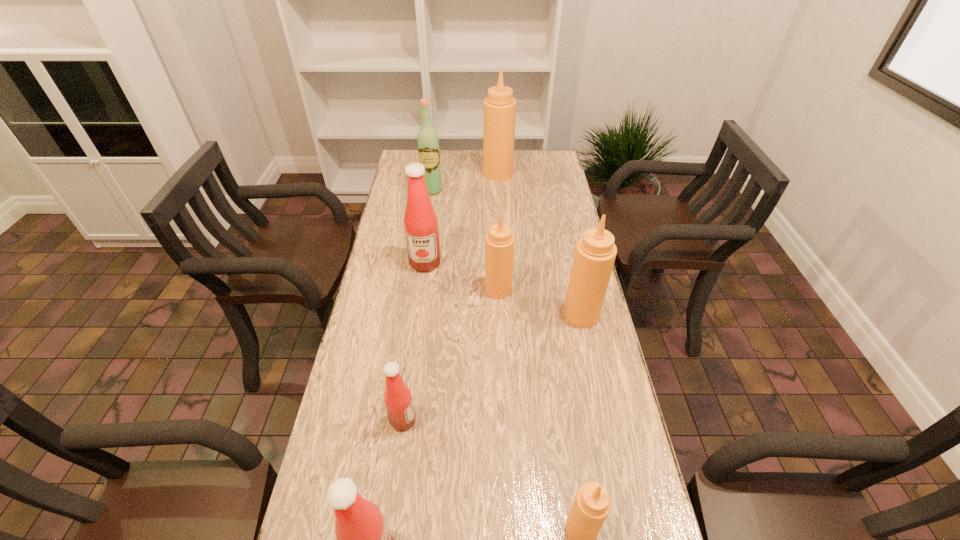
I want to click on the sixth farthest object, so click(x=398, y=400).

Locate an element on the screen. This screenshot has height=540, width=960. the fifth farthest condiment is located at coordinates (398, 400).

At what (x,y) coordinates should I click in order to perform the action: click on free region located 0.140m on the right of the biggest tan condiment. Please return your answer as a coordinate pair (x, y). Looking at the image, I should click on (544, 173).

This screenshot has height=540, width=960. I want to click on vacant space situated on the front-facing side of the white wine bottle, so click(x=425, y=239).

The image size is (960, 540). In order to click on free space located 0.190m on the front-facing side of the sixth nearest condiment in this screenshot , I will do `click(419, 316)`.

Identify the location of vacant point located on the back of the rightmost tan condiment. (574, 284).

The image size is (960, 540). In order to click on free location located 0.390m on the front of the fifth nearest object in this screenshot , I will do `click(503, 411)`.

I want to click on vacant region located on the front-facing side of the third nearest object, so coord(452,420).

Locate an element on the screen. object that is at the far edge is located at coordinates (499, 106).

This screenshot has height=540, width=960. Identify the location of wine bottle that is at the left edge. (427, 137).